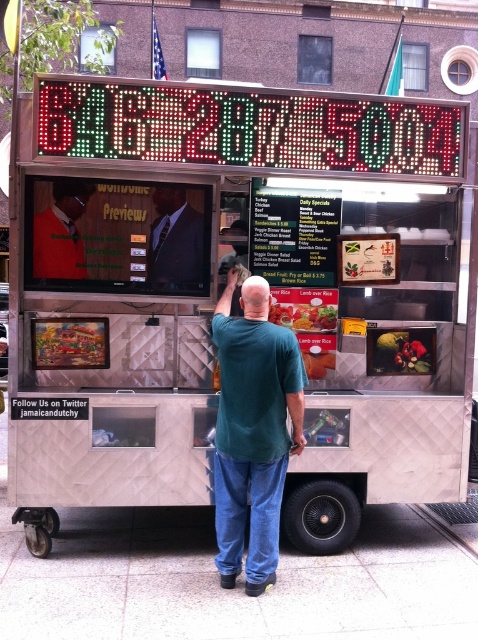
Question: Among these points, which one is farthest from the camera?

Choices:
 (A) (229, 360)
 (B) (415, 339)

Answer: (B)

Question: Which point appears closest to the camera in this image?

Choices:
 (A) (308, 314)
 (B) (73, 246)

Answer: (B)

Question: Which of the following is the closest to the observer?

Choices:
 (A) (55, 182)
 (B) (195, 262)
 (C) (232, 413)
 (D) (301, 307)

Answer: (C)

Question: Is matte black suit at center wider than smooth plastic tray at center?

Choices:
 (A) yes
 (B) no

Answer: (B)

Question: From the image, what is the correct spatial relationship of metallic silver food truck at center in relation to smooth plastic tray at center?

Choices:
 (A) left
 (B) right

Answer: (A)

Question: Is metallic silver food truck at center smaller than smooth plastic fruit at center?

Choices:
 (A) no
 (B) yes

Answer: (A)